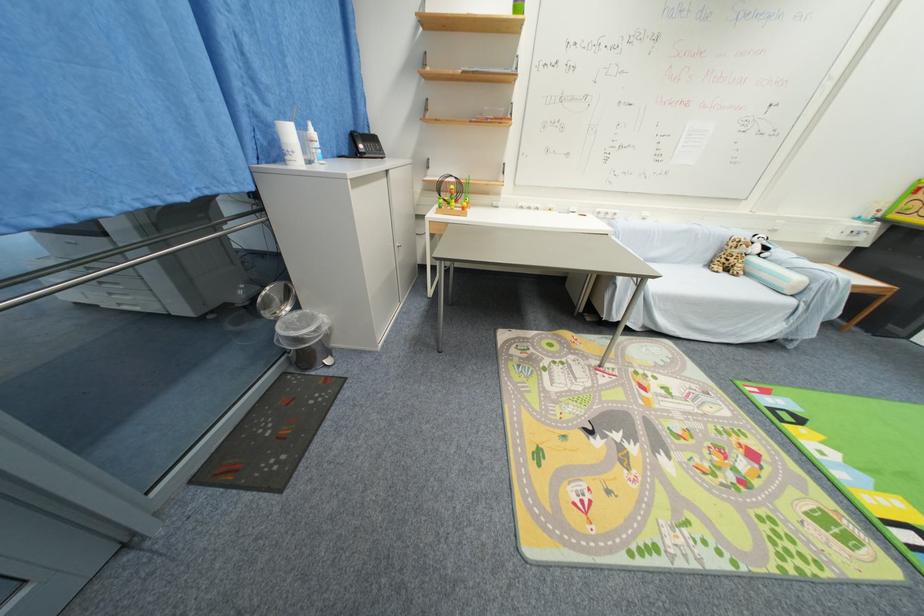
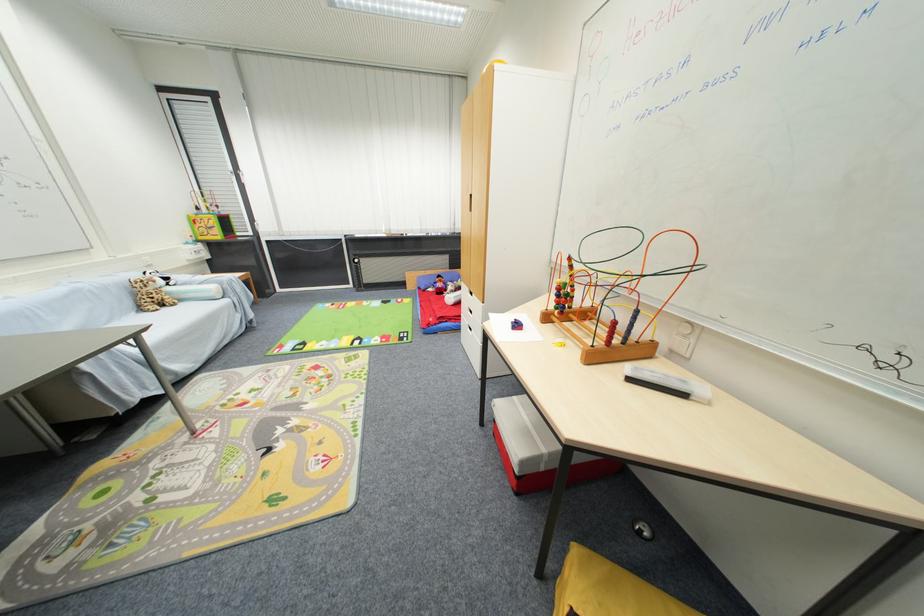
In the second image, find the point that corresponds to (730,276) in the first image.

(171, 310)